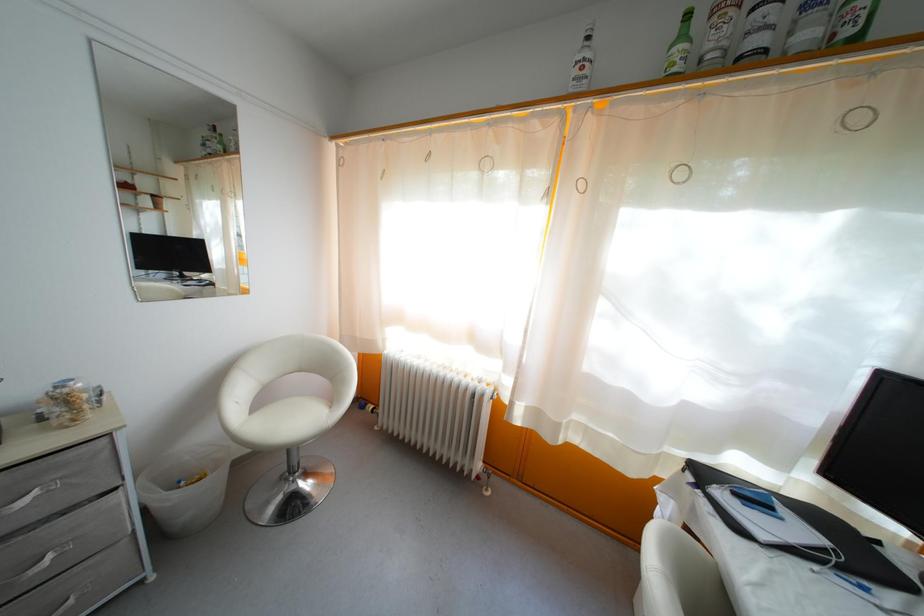
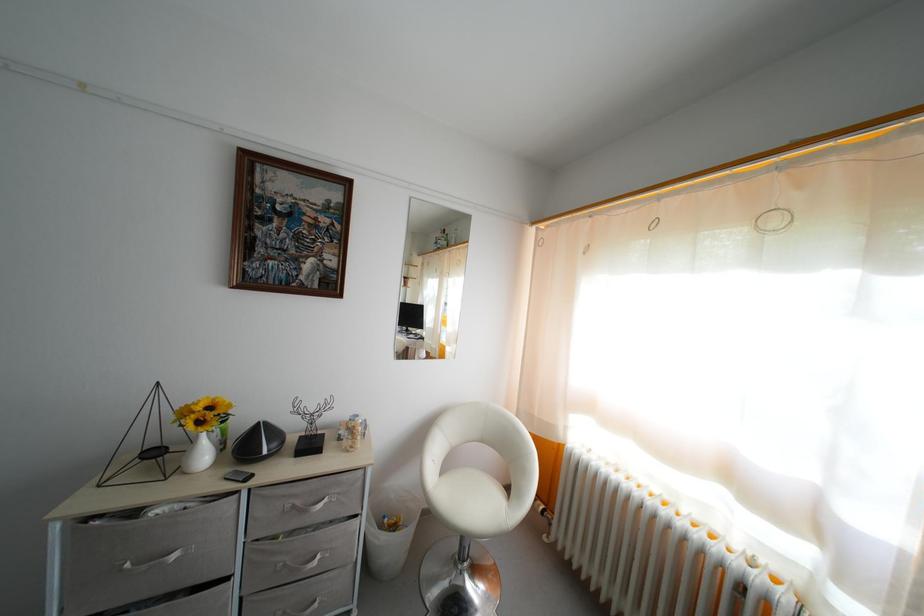
Question: Based on the continuous images, in which direction is the camera rotating? Reply with the corresponding letter.

Choices:
 (A) Left
 (B) Right
 (C) Up
 (D) Down

Answer: (A)